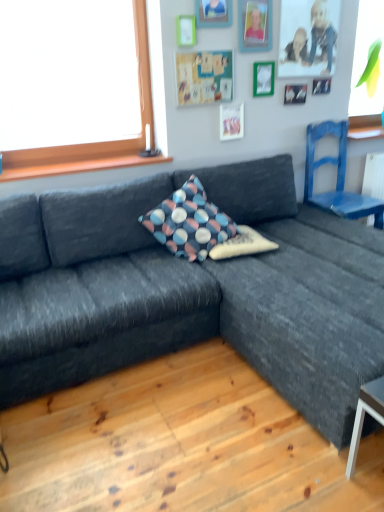
Question: Is green matte picture frame at upper center, the fifth picture frame in the left-to-right sequence, oriented away from textured fabric pillow at center, the 2th pillow positioned from the top?

Choices:
 (A) yes
 (B) no

Answer: (B)

Question: From the image's perspective, is green matte picture frame at upper center, arranged as the 2th picture frame when viewed from the right, over textured fabric pillow at center, the 2th pillow positioned from the top?

Choices:
 (A) yes
 (B) no

Answer: (A)

Question: Does green matte picture frame at upper center, the fifth picture frame in the left-to-right sequence, turn towards textured fabric pillow at center, which appears as the first pillow when ordered from the bottom?

Choices:
 (A) no
 (B) yes

Answer: (A)

Question: Does green matte picture frame at upper center, arranged as the 2th picture frame when viewed from the right, appear on the right side of textured fabric pillow at center, which appears as the first pillow when ordered from the bottom?

Choices:
 (A) yes
 (B) no

Answer: (A)

Question: From a real-world perspective, is green matte picture frame at upper center, the fifth picture frame in the left-to-right sequence, positioned under textured fabric pillow at center, which appears as the first pillow when ordered from the bottom, based on gravity?

Choices:
 (A) no
 (B) yes

Answer: (A)

Question: From the image's perspective, is textured fabric pillow at center, the 2th pillow positioned from the top, located above or below wooden picture frame at upper center, the second picture frame when ordered from left to right?

Choices:
 (A) below
 (B) above

Answer: (A)

Question: Is textured fabric pillow at center, which appears as the first pillow when ordered from the bottom, taller or shorter than wooden picture frame at upper center, which appears as the fifth picture frame when viewed from the right?

Choices:
 (A) tall
 (B) short

Answer: (B)

Question: From a real-world perspective, relative to wooden picture frame at upper center, the second picture frame when ordered from left to right, is textured fabric pillow at center, which appears as the first pillow when ordered from the bottom, vertically above or below?

Choices:
 (A) below
 (B) above

Answer: (A)

Question: Which is correct: textured fabric pillow at center, which appears as the first pillow when ordered from the bottom, is inside wooden picture frame at upper center, which appears as the fifth picture frame when viewed from the right, or outside of it?

Choices:
 (A) inside
 (B) outside

Answer: (B)

Question: In terms of size, does matte green bulletin board at upper center appear bigger or smaller than polka dot fabric pillow at center, placed as the first pillow when sorted from top to bottom?

Choices:
 (A) big
 (B) small

Answer: (B)

Question: In terms of height, does matte green bulletin board at upper center look taller or shorter compared to polka dot fabric pillow at center, which is counted as the second pillow, starting from the bottom?

Choices:
 (A) tall
 (B) short

Answer: (B)

Question: Considering the positions of matte green bulletin board at upper center and polka dot fabric pillow at center, placed as the first pillow when sorted from top to bottom, in the image, is matte green bulletin board at upper center wider or thinner than polka dot fabric pillow at center, placed as the first pillow when sorted from top to bottom,?

Choices:
 (A) wide
 (B) thin

Answer: (B)

Question: From a real-world perspective, relative to polka dot fabric pillow at center, placed as the first pillow when sorted from top to bottom, is matte green bulletin board at upper center vertically above or below?

Choices:
 (A) below
 (B) above

Answer: (B)

Question: From a real-world perspective, is green matte picture frame at upper center, the 6th picture frame positioned from the right, positioned above or below wooden picture frame at upper center, the second picture frame when ordered from left to right?

Choices:
 (A) below
 (B) above

Answer: (A)

Question: Considering their positions, is green matte picture frame at upper center, which is counted as the 1th picture frame, starting from the left, located in front of or behind wooden picture frame at upper center, which appears as the fifth picture frame when viewed from the right?

Choices:
 (A) behind
 (B) front

Answer: (A)